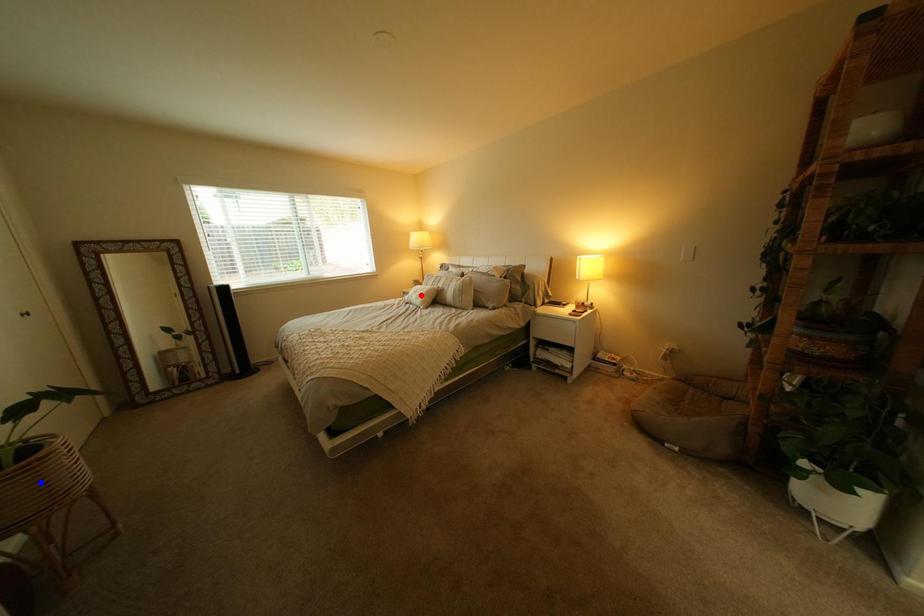
Question: Which of the two points in the image is closer to the camera?

Choices:
 (A) Blue point is closer.
 (B) Red point is closer.

Answer: (A)